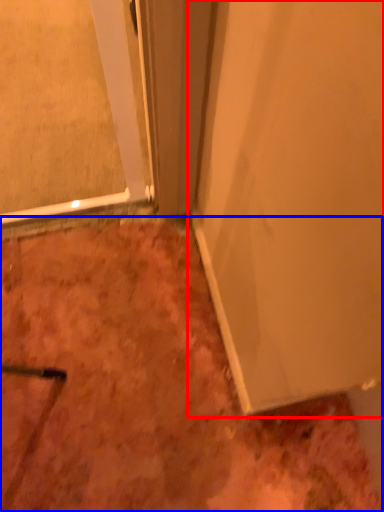
Question: Which object appears farthest to the camera in this image, door (highlighted by a red box) or dirt (highlighted by a blue box)?

Choices:
 (A) door
 (B) dirt

Answer: (B)